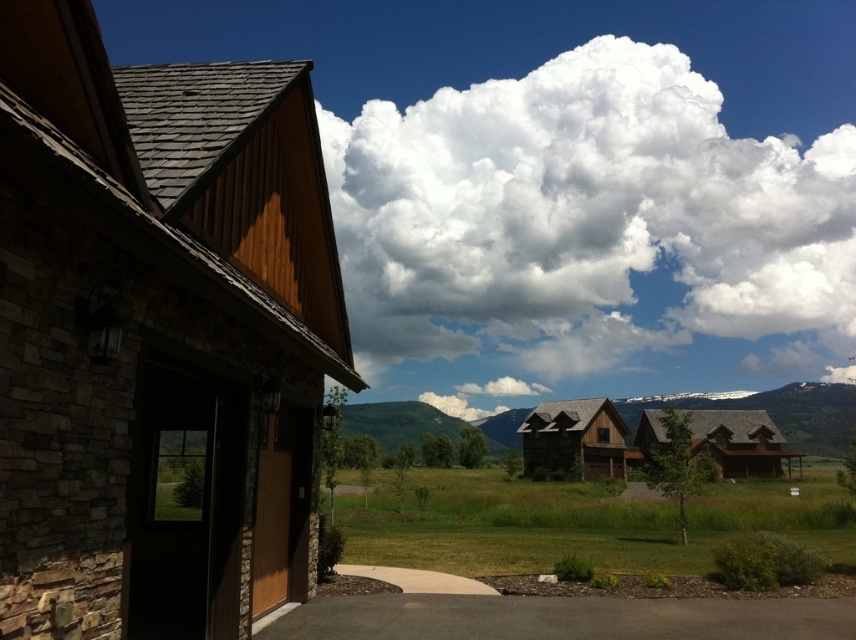
Question: Is black asphalt driveway at lower center smaller than green grassy hill at center?

Choices:
 (A) no
 (B) yes

Answer: (B)

Question: Which point is closer to the camera taking this photo?

Choices:
 (A) (403, 412)
 (B) (375, 577)
 (C) (664, 51)

Answer: (B)

Question: Can you confirm if white fluffy cloud at upper center is positioned to the right of green grassy hill at center?

Choices:
 (A) no
 (B) yes

Answer: (B)

Question: Among these points, which one is nearest to the camera?

Choices:
 (A) (379, 419)
 (B) (331, 596)
 (C) (411, 588)

Answer: (B)

Question: Is the position of white fluffy cloud at upper center less distant than that of smooth concrete driveway at lower center?

Choices:
 (A) no
 (B) yes

Answer: (A)

Question: Which object appears closest to the camera in this image?

Choices:
 (A) green grassy hill at center
 (B) black asphalt driveway at lower center
 (C) smooth concrete driveway at lower center
 (D) wooden cabin at center

Answer: (B)